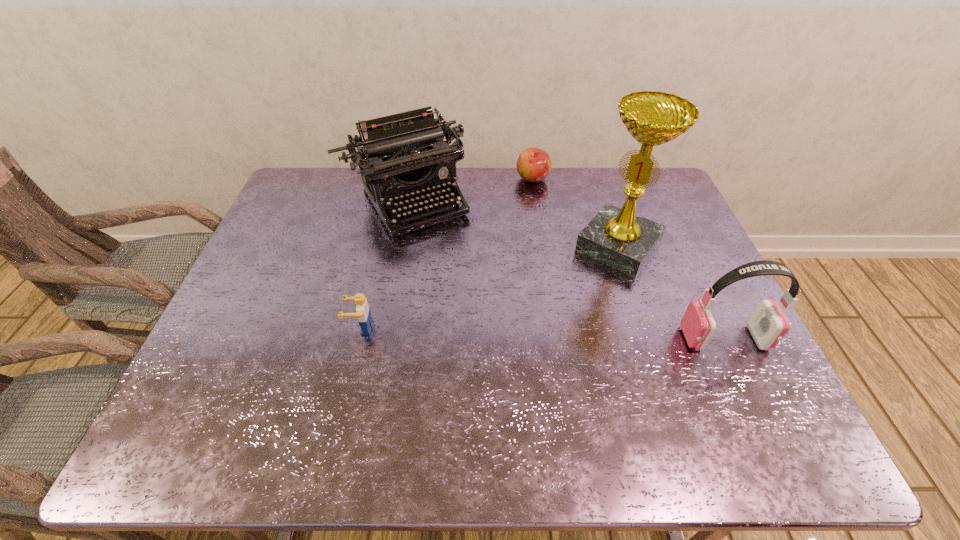
In order to click on Lego in this screenshot , I will do `click(365, 320)`.

Identify the location of earphone. The width and height of the screenshot is (960, 540). (767, 324).

Locate an element on the screen. apple is located at coordinates (534, 164).

Identify the location of award. The height and width of the screenshot is (540, 960). (617, 237).

Locate an element on the screen. typewriter is located at coordinates coord(402,155).

Locate an element on the screen. The image size is (960, 540). vacant space located on the face of the Lego is located at coordinates (253, 328).

Find the location of a particular element. free space located 0.300m on the face of the Lego is located at coordinates (225, 328).

This screenshot has width=960, height=540. I want to click on free space located on the face of the Lego, so click(x=270, y=328).

Where is `free space located on the outer surface of the earphone`? free space located on the outer surface of the earphone is located at coordinates (534, 338).

At what (x,y) coordinates should I click in order to perform the action: click on free space located 0.290m on the outer surface of the earphone. Please return your answer as a coordinate pair (x, y). The image size is (960, 540). Looking at the image, I should click on (563, 338).